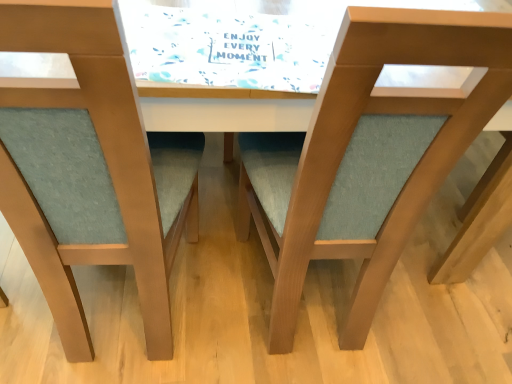
Question: Considering the positions of matte wood chair at center, arranged as the second chair when viewed from the left, and matte wood chair at center, positioned as the first chair in left-to-right order, in the image, is matte wood chair at center, arranged as the second chair when viewed from the left, taller or shorter than matte wood chair at center, positioned as the first chair in left-to-right order,?

Choices:
 (A) tall
 (B) short

Answer: (B)

Question: Is matte wood chair at center, arranged as the second chair when viewed from the left, situated inside matte wood chair at center, positioned as the 2th chair in right-to-left order, or outside?

Choices:
 (A) inside
 (B) outside

Answer: (B)

Question: Considering their positions, is matte wood chair at center, acting as the 1th chair starting from the right, located in front of or behind matte wood chair at center, positioned as the 2th chair in right-to-left order?

Choices:
 (A) behind
 (B) front

Answer: (A)

Question: Considering the positions of point (159, 296) and point (275, 185), is point (159, 296) closer or farther from the camera than point (275, 185)?

Choices:
 (A) farther
 (B) closer

Answer: (B)

Question: In the image, is matte wood chair at center, positioned as the 2th chair in right-to-left order, positioned in front of or behind matte wood chair at center, arranged as the second chair when viewed from the left?

Choices:
 (A) front
 (B) behind

Answer: (A)

Question: Is matte wood chair at center, positioned as the first chair in left-to-right order, bigger or smaller than matte wood chair at center, arranged as the second chair when viewed from the left?

Choices:
 (A) big
 (B) small

Answer: (A)

Question: In terms of width, does matte wood chair at center, positioned as the first chair in left-to-right order, look wider or thinner when compared to matte wood chair at center, arranged as the second chair when viewed from the left?

Choices:
 (A) thin
 (B) wide

Answer: (B)